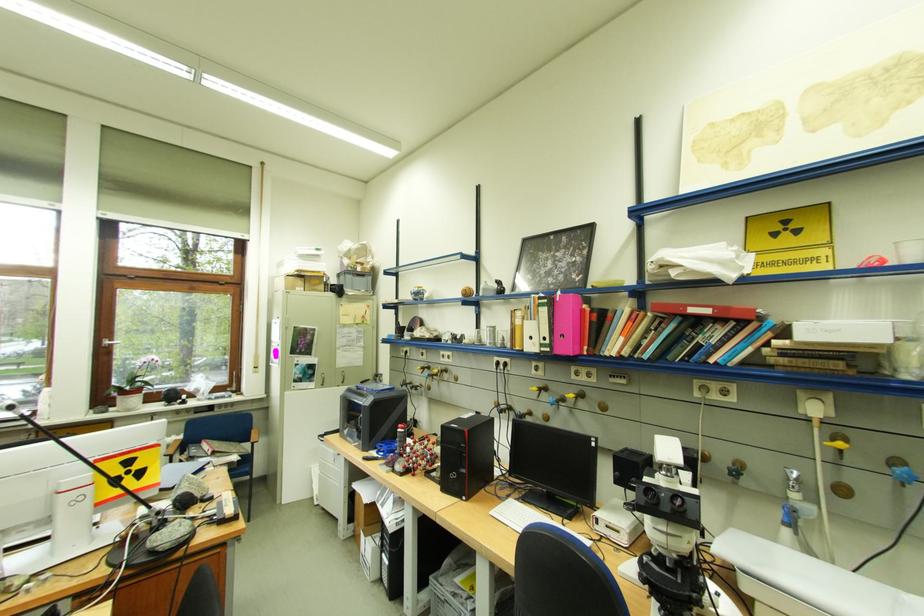
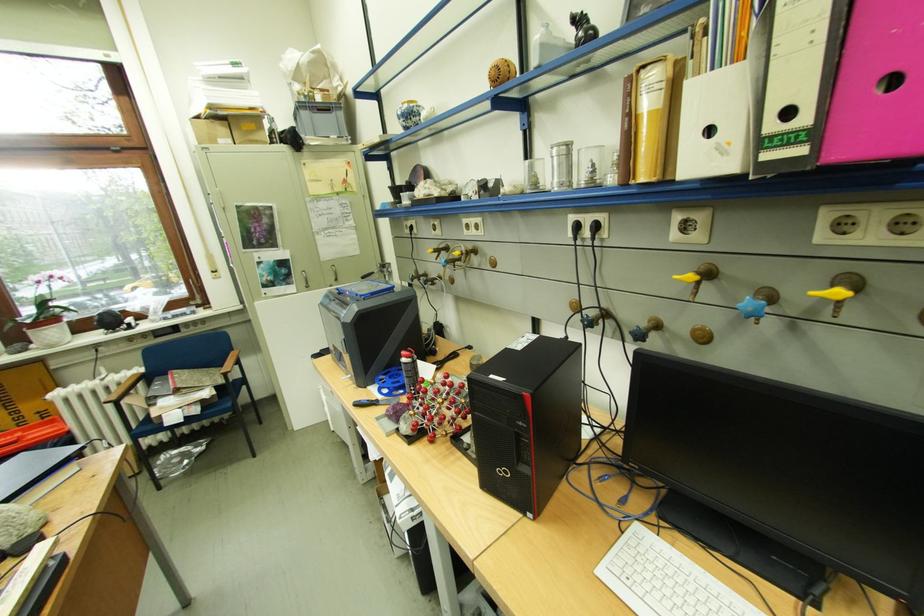
The point at (428, 298) is marked in the first image. Where is the corresponding point in the second image?

(419, 122)